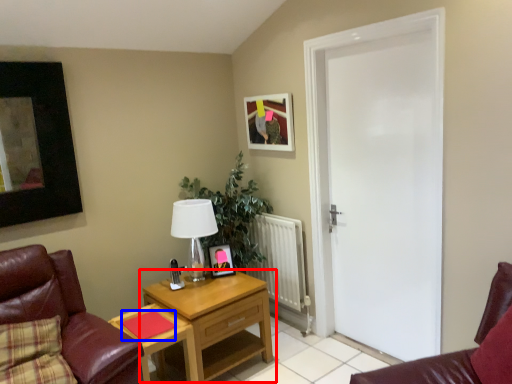
Question: Among these objects, which one is farthest to the camera, nightstand (highlighted by a red box) or pad (highlighted by a blue box)?

Choices:
 (A) nightstand
 (B) pad

Answer: (A)